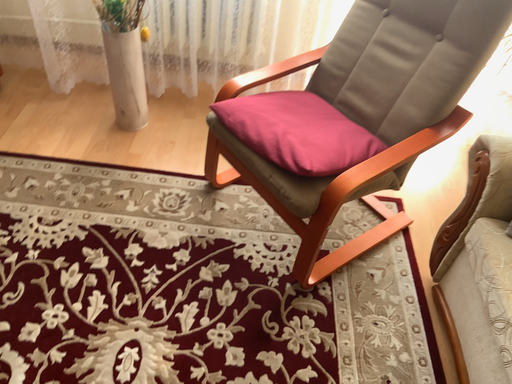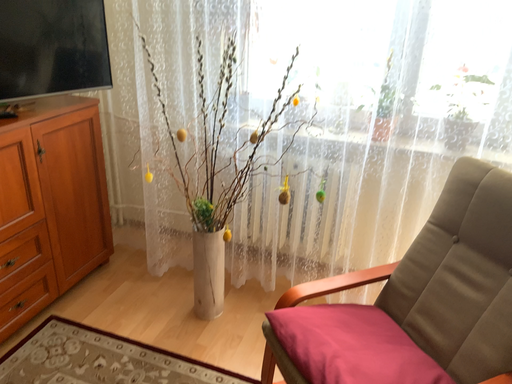
Question: Which way did the camera rotate in the video?

Choices:
 (A) rotated downward
 (B) rotated upward

Answer: (B)